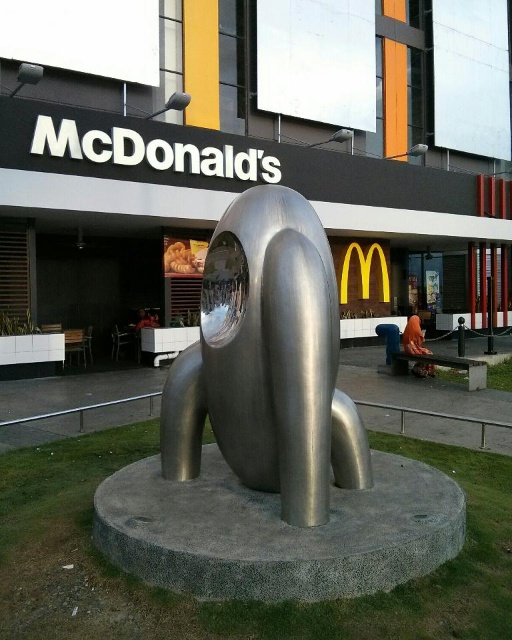
In the scene shown: You are a city planner assessing space requirements for a new exhibit. The polished stainless steel sculpture at center and the shiny metallic dog at center are both candidates. If the available space is exactly the width of the narrower of the two, which sculpture should you choose to ensure it fits?

The shiny metallic dog at center is narrower than the polished stainless steel sculpture at center, so you should choose the shiny metallic dog at center to ensure it fits within the available space.

You are an art curator planning to move the shiny metallic dog at center to a new exhibition space. The entrance of the exhibition hall has a height restriction of 3 meters. Can the polished stainless steel sculpture at center fit through the entrance without any adjustments?

The polished stainless steel sculpture at center is larger than the shiny metallic dog at center, so it might exceed the 3 meters height restriction. Further measurements are needed to confirm.